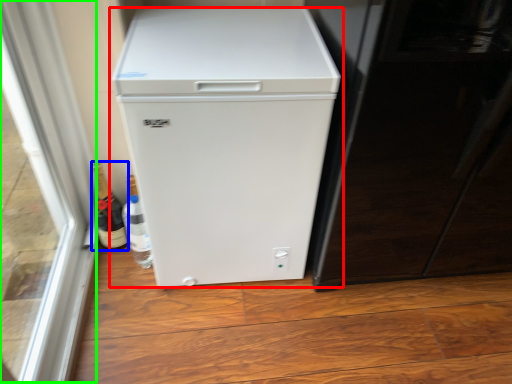
Question: Which object is positioned farthest from refrigerator (highlighted by a red box)? Select from bottle (highlighted by a blue box) and glass door (highlighted by a green box).

Choices:
 (A) bottle
 (B) glass door

Answer: (A)